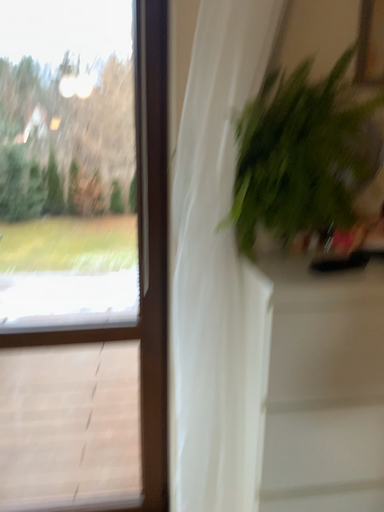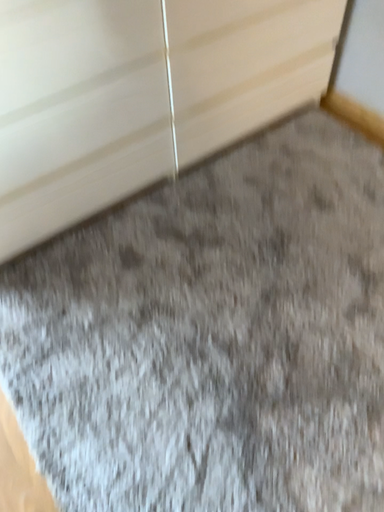
Question: How did the camera likely rotate when shooting the video?

Choices:
 (A) rotated left
 (B) rotated right

Answer: (B)